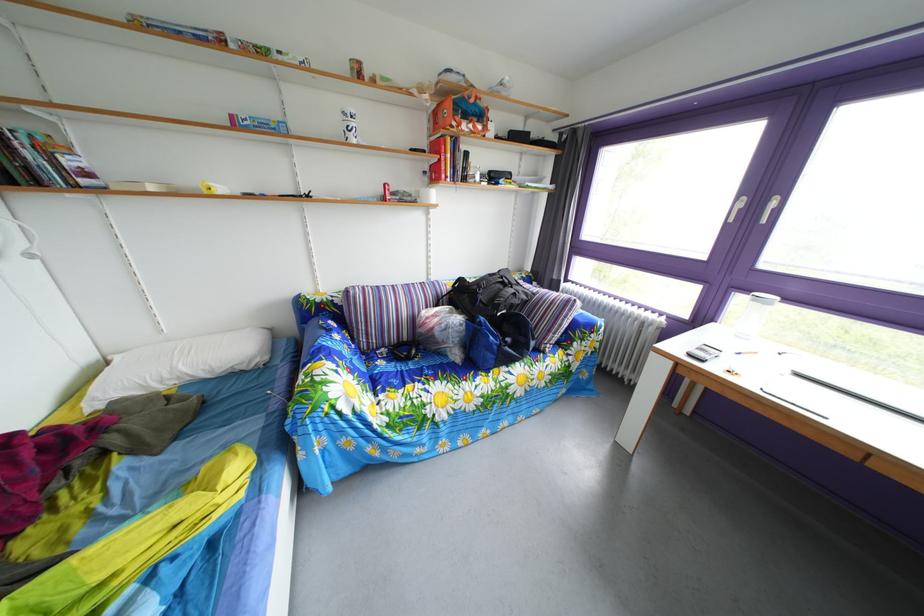
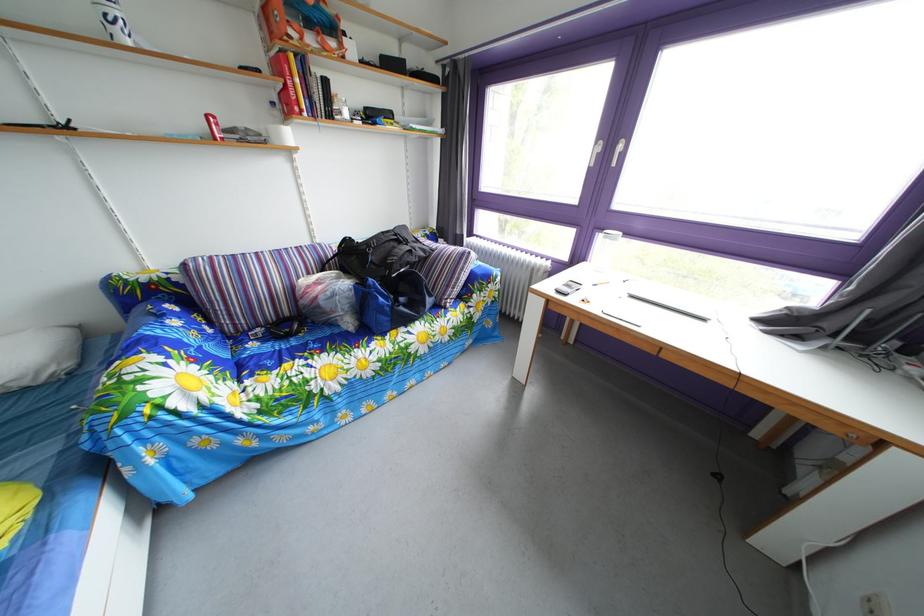
Locate, in the second image, the point that corresponds to [249,358] in the first image.

(18, 370)